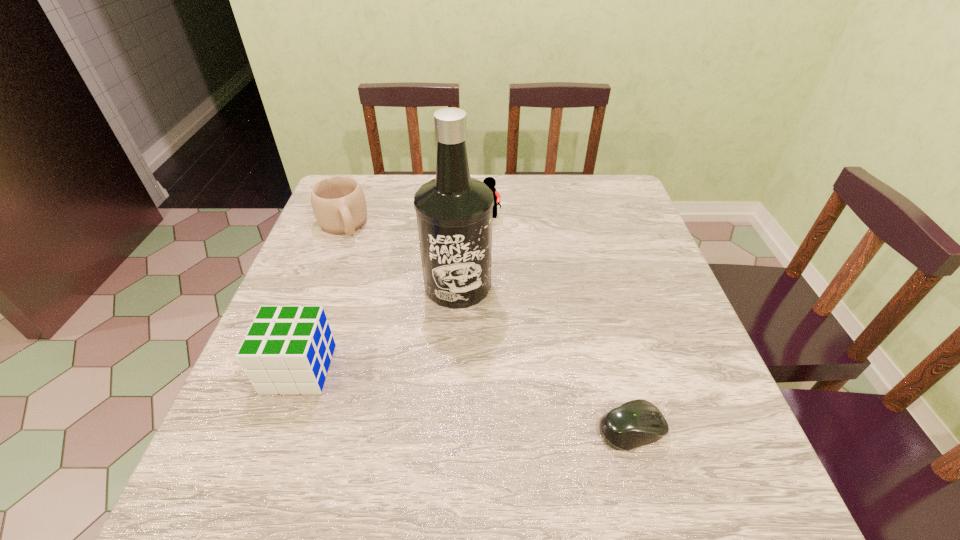
You are a GUI agent. You are given a task and a screenshot of the screen. Output one action in this format:
    pyautogui.click(x=<x>, y=<y>)
    Task: Click on the vacant space on the desktop that is between the second nearest object and the rightmost object and is positioned on the side of the mug with the handle
    The height and width of the screenshot is (540, 960).
    Given the screenshot: What is the action you would take?
    pyautogui.click(x=420, y=390)

You are a GUI agent. You are given a task and a screenshot of the screen. Output one action in this format:
    pyautogui.click(x=<x>, y=<y>)
    Task: Click on the vacant space on the desktop that is between the second nearest object and the mouse and is positioned on the front-facing side of the Lego
    The height and width of the screenshot is (540, 960).
    Given the screenshot: What is the action you would take?
    pyautogui.click(x=418, y=390)

I want to click on vacant space on the desktop that is between the cube and the rightmost object and is positioned on the front label of the tallest object, so click(498, 405).